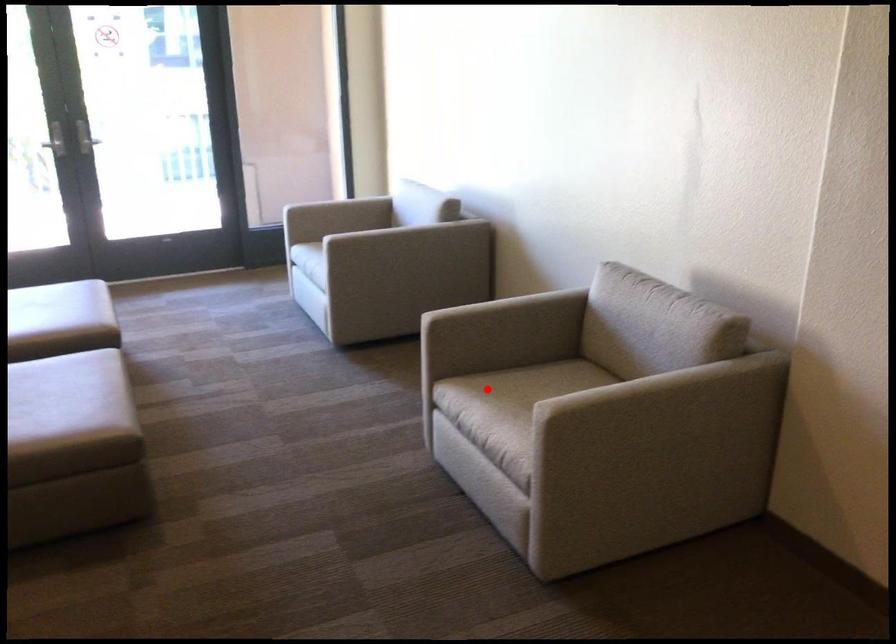
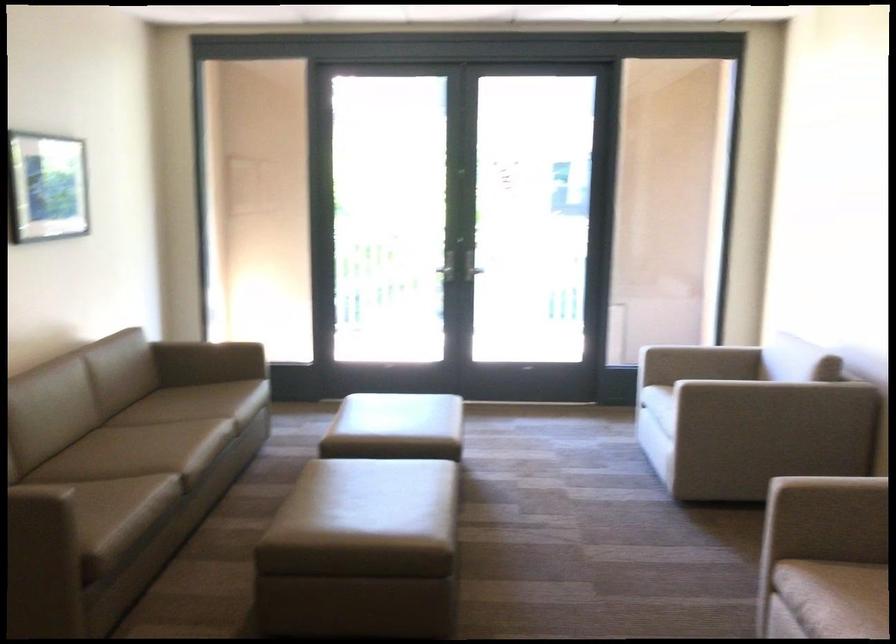
In the second image, find the point that corresponds to the highlighted location in the first image.

(856, 591)